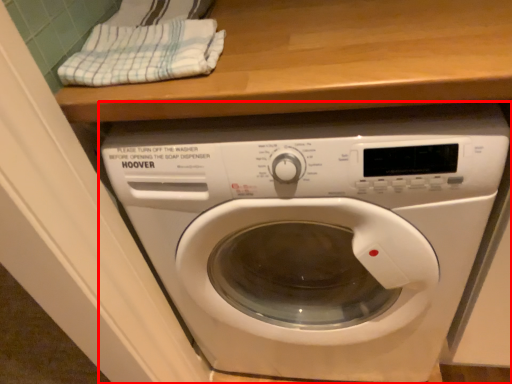
Question: From the image's perspective, what is the correct spatial positioning of washing machine (annotated by the red box) in reference to clothe?

Choices:
 (A) below
 (B) above

Answer: (A)